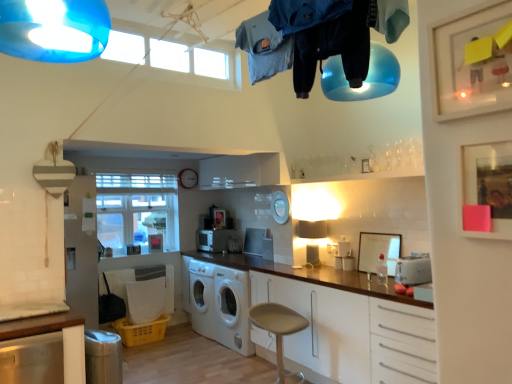
Question: Is the position of metallic silver toaster at center, the 2th appliance from the left, more distant than that of white matte washing machine at center?

Choices:
 (A) yes
 (B) no

Answer: (A)

Question: From the image's perspective, does metallic silver toaster at center, the 2th appliance from the left, appear higher than white matte washing machine at center?

Choices:
 (A) yes
 (B) no

Answer: (A)

Question: Is metallic silver toaster at center, which ranks as the 2th appliance in back-to-front order, positioned with its back to white matte washing machine at center?

Choices:
 (A) no
 (B) yes

Answer: (A)

Question: Can you confirm if metallic silver toaster at center, the 2th appliance from the left, is bigger than white matte washing machine at center?

Choices:
 (A) yes
 (B) no

Answer: (B)

Question: Can you confirm if metallic silver toaster at center, the 2th appliance from the left, is wider than white matte washing machine at center?

Choices:
 (A) yes
 (B) no

Answer: (B)

Question: Is clear glass window at center inside or outside of white matte picture frame at right, positioned as the first picture frame in back-to-front order?

Choices:
 (A) inside
 (B) outside

Answer: (B)

Question: In terms of width, does clear glass window at center look wider or thinner when compared to white matte picture frame at right, positioned as the first picture frame in right-to-left order?

Choices:
 (A) wide
 (B) thin

Answer: (A)

Question: From the image's perspective, relative to white matte picture frame at right, the 2th picture frame in the top-to-bottom sequence, is clear glass window at center above or below?

Choices:
 (A) above
 (B) below

Answer: (A)

Question: Is clear glass window at center to the left or to the right of white matte picture frame at right, which ranks as the 1th picture frame in bottom-to-top order, in the image?

Choices:
 (A) left
 (B) right

Answer: (A)

Question: From a real-world perspective, is dark blue fabric pants at upper center, which ranks as the 2th clothing in front-to-back order, above or below white matte picture frame at right, which ranks as the 1th picture frame in bottom-to-top order?

Choices:
 (A) below
 (B) above

Answer: (B)

Question: Considering their positions, is dark blue fabric pants at upper center, acting as the second clothing starting from the back, located in front of or behind white matte picture frame at right, positioned as the first picture frame in back-to-front order?

Choices:
 (A) front
 (B) behind

Answer: (A)

Question: Is point (320, 24) closer or farther from the camera than point (395, 238)?

Choices:
 (A) closer
 (B) farther

Answer: (A)

Question: From the image's perspective, is dark blue fabric pants at upper center, which ranks as the 2th clothing in front-to-back order, positioned above or below white matte picture frame at right, which is counted as the second picture frame, starting from the front?

Choices:
 (A) above
 (B) below

Answer: (A)

Question: Based on their sizes in the image, would you say white matte washing machine at center is bigger or smaller than clear glass window at center?

Choices:
 (A) big
 (B) small

Answer: (A)

Question: From a real-world perspective, is white matte washing machine at center physically located above or below clear glass window at center?

Choices:
 (A) above
 (B) below

Answer: (B)